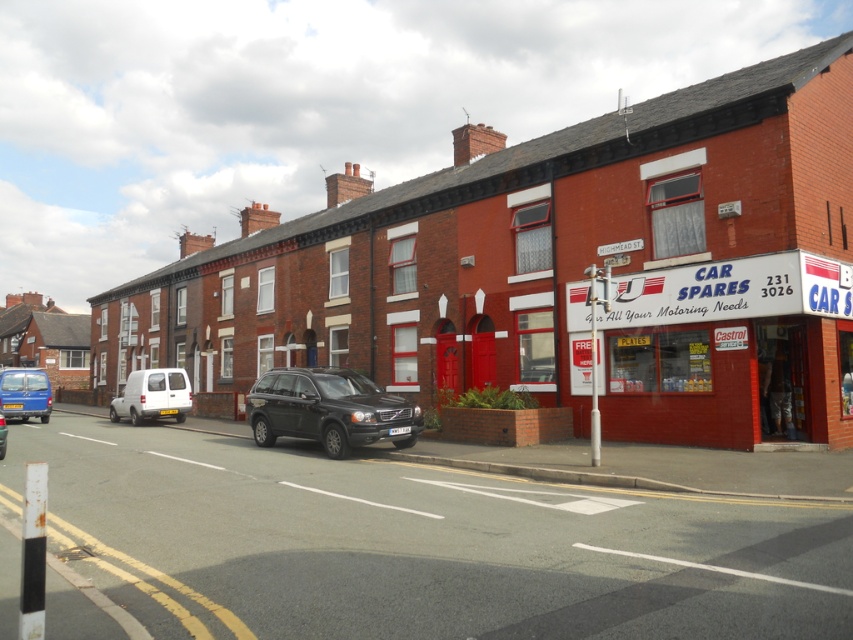
This screenshot has height=640, width=853. What do you see at coordinates (712, 292) in the screenshot? I see `red brick car spares shop at right` at bounding box center [712, 292].

Who is more forward, (x=630, y=314) or (x=169, y=406)?

Point (x=630, y=314) is more forward.

Between point (805, 300) and point (132, 380), which one is positioned in front?

Point (805, 300)

The image size is (853, 640). Identify the location of red brick car spares shop at right. (712, 292).

Is the position of red brick car spares shop at right less distant than that of blue matte van at center?

Yes, it is.

Can you confirm if red brick car spares shop at right is smaller than blue matte van at center?

No, red brick car spares shop at right is not smaller than blue matte van at center.

The width and height of the screenshot is (853, 640). Identify the location of red brick car spares shop at right. point(712,292).

Where is `red brick car spares shop at right`? Image resolution: width=853 pixels, height=640 pixels. red brick car spares shop at right is located at coordinates click(712, 292).

Can you confirm if white matte van at center is bigger than matte black suv at center?

No, white matte van at center is not bigger than matte black suv at center.

Can you confirm if white matte van at center is smaller than matte black suv at center?

Indeed, white matte van at center has a smaller size compared to matte black suv at center.

The height and width of the screenshot is (640, 853). Describe the element at coordinates (152, 396) in the screenshot. I see `white matte van at center` at that location.

Find the location of a particular element. The width and height of the screenshot is (853, 640). white matte van at center is located at coordinates (152, 396).